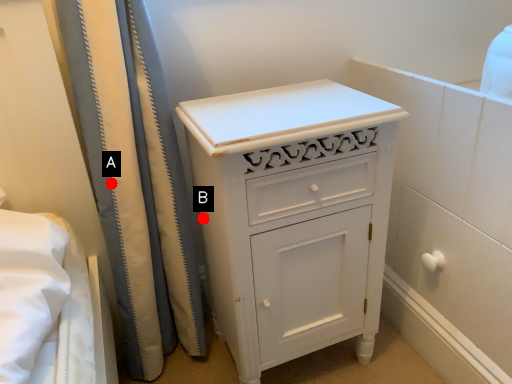
Question: Two points are circled on the image, labeled by A and B beside each circle. Among these points, which one is nearest to the camera?

Choices:
 (A) A is closer
 (B) B is closer

Answer: (A)